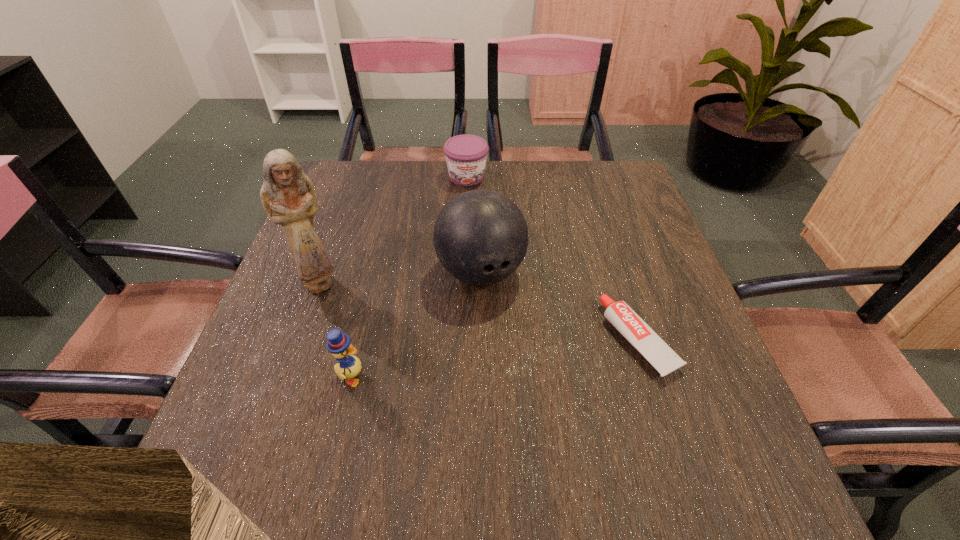
You are a GUI agent. You are given a task and a screenshot of the screen. Output one action in this format:
    pyautogui.click(x=<x>, y=<y>)
    Task: Click on the second object from left to right
    
    Given the screenshot: What is the action you would take?
    pyautogui.click(x=339, y=344)

Image resolution: width=960 pixels, height=540 pixels. In order to click on duckling in this screenshot , I will do `click(339, 344)`.

Find the location of a particular element. This screenshot has width=960, height=540. the shortest object is located at coordinates (619, 314).

Find the location of a particular element. The height and width of the screenshot is (540, 960). the rightmost object is located at coordinates (619, 314).

I want to click on the fourth shortest object, so click(x=481, y=237).

Where is `the farthest object`? This screenshot has width=960, height=540. the farthest object is located at coordinates (466, 155).

Locate an element on the screen. The height and width of the screenshot is (540, 960). jam is located at coordinates (466, 155).

Identify the location of figurine. (287, 195).

Identify the location of the leftmost object. The width and height of the screenshot is (960, 540). (287, 195).

The width and height of the screenshot is (960, 540). Find the location of `vacant region located 0.200m on the face of the third shortest object, where the monocle is placed`. vacant region located 0.200m on the face of the third shortest object, where the monocle is placed is located at coordinates (468, 377).